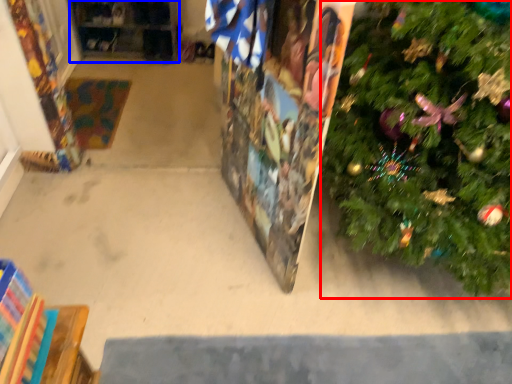
Question: Which object appears farthest to the camera in this image, christmas tree (highlighted by a red box) or shelf (highlighted by a blue box)?

Choices:
 (A) christmas tree
 (B) shelf

Answer: (B)